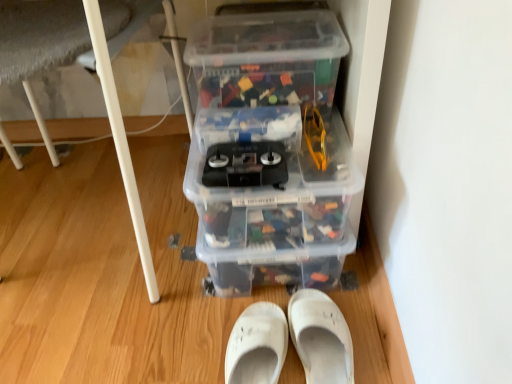
Image resolution: width=512 pixels, height=384 pixels. I want to click on vacant region in front of transparent plastic storage box at upper center, positioned as the first storage box in top-to-bottom order, so click(249, 137).